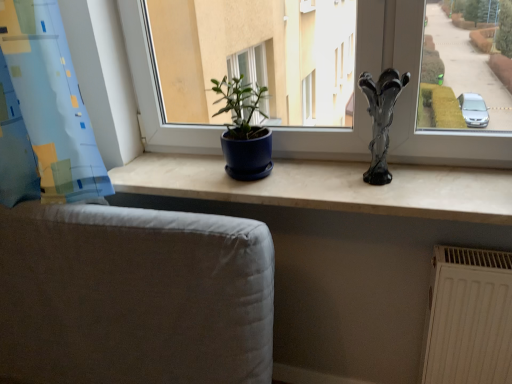
You are a GUI agent. You are given a task and a screenshot of the screen. Output one action in this format:
    pyautogui.click(x=<x>, y=<y>)
    Task: Click on the vacant space underneath matte blue pot at center (from a real-world perspective)
    This screenshot has height=384, width=512.
    Given the screenshot: What is the action you would take?
    pyautogui.click(x=366, y=165)